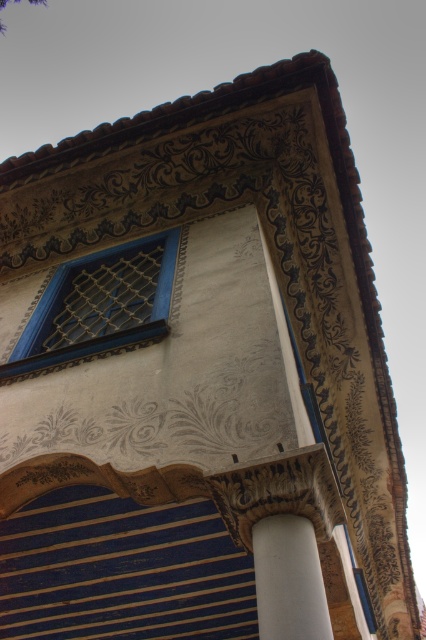
Question: Can you confirm if blue painted wood lattice at upper left is positioned above white smooth column at lower center?

Choices:
 (A) yes
 (B) no

Answer: (A)

Question: Does blue painted wood lattice at upper left have a larger size compared to white smooth column at lower center?

Choices:
 (A) no
 (B) yes

Answer: (B)

Question: Among these objects, which one is farthest from the camera?

Choices:
 (A) blue painted wood lattice at upper left
 (B) white smooth column at lower center

Answer: (A)

Question: Is blue painted wood lattice at upper left smaller than white smooth column at lower center?

Choices:
 (A) no
 (B) yes

Answer: (A)

Question: Which point is farther from the camera taking this photo?

Choices:
 (A) (270, 634)
 (B) (109, 332)

Answer: (B)

Question: Which point is farther to the camera?

Choices:
 (A) (118, 250)
 (B) (259, 541)

Answer: (A)